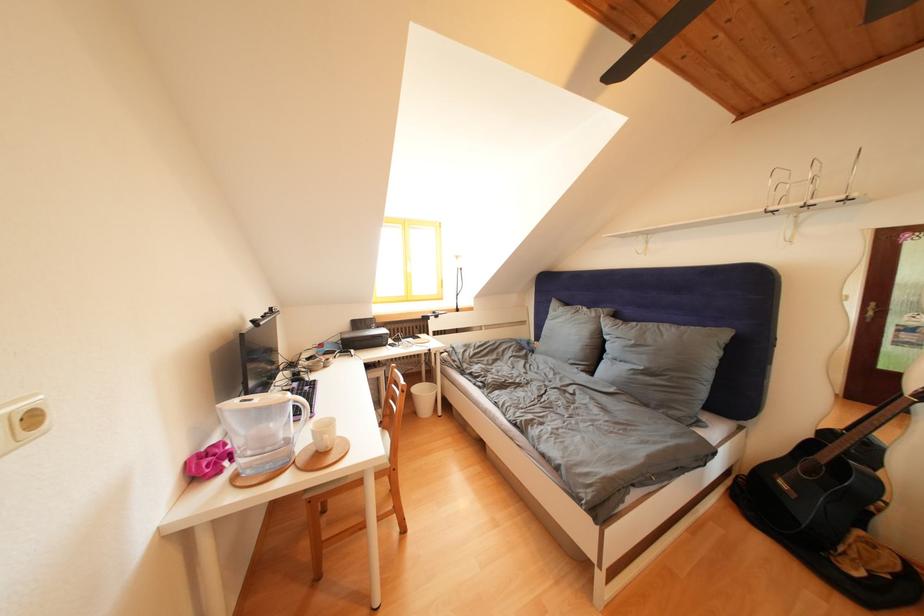
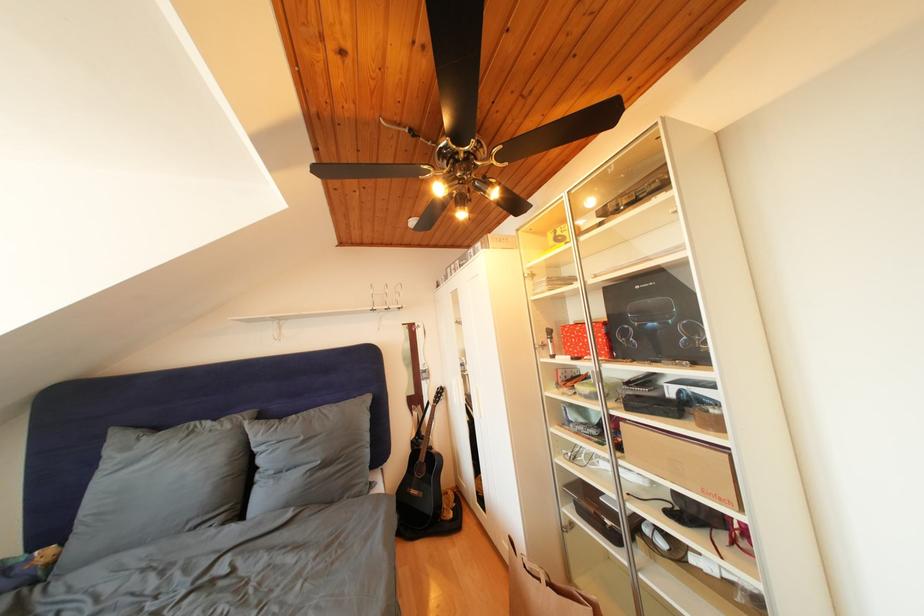
Where in the second image is the point corresponding to (640,347) from the first image?

(310, 444)